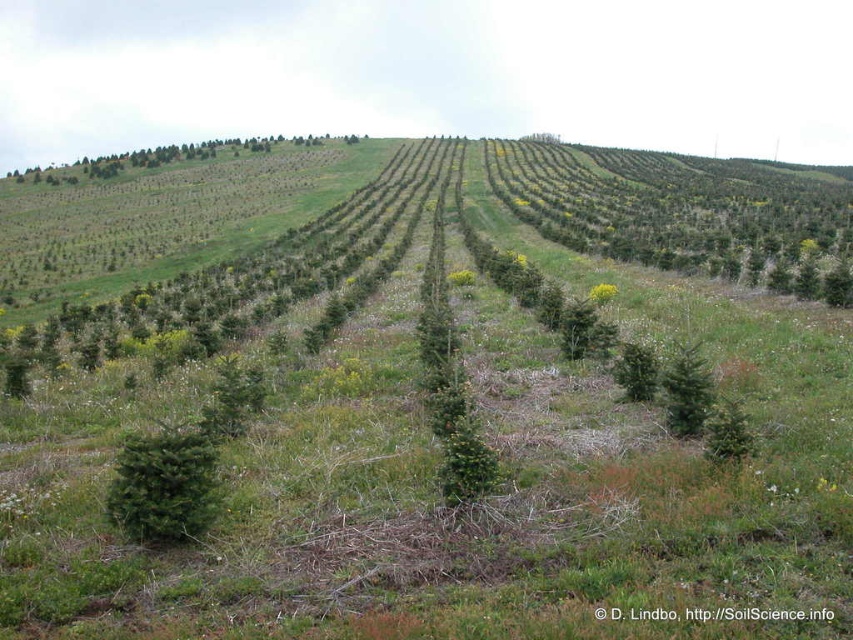
You are standing at the point labeled point (x=740, y=419) and want to walk towards the point labeled point (x=637, y=385). Which direction should you face to walk directly towards it?

Since point (x=740, y=419) is closer to the camera than point (x=637, y=385), you should face towards the upper left direction to walk directly towards it.